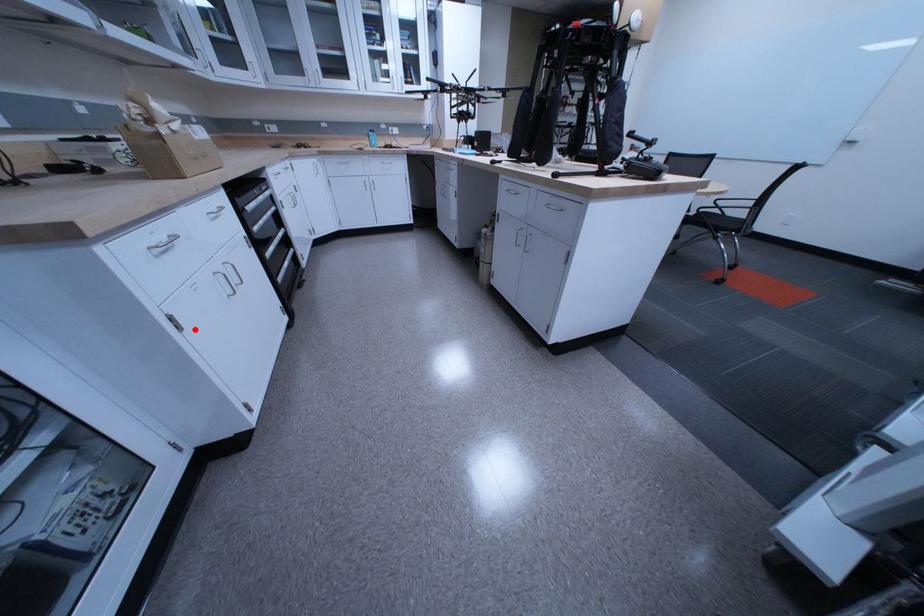
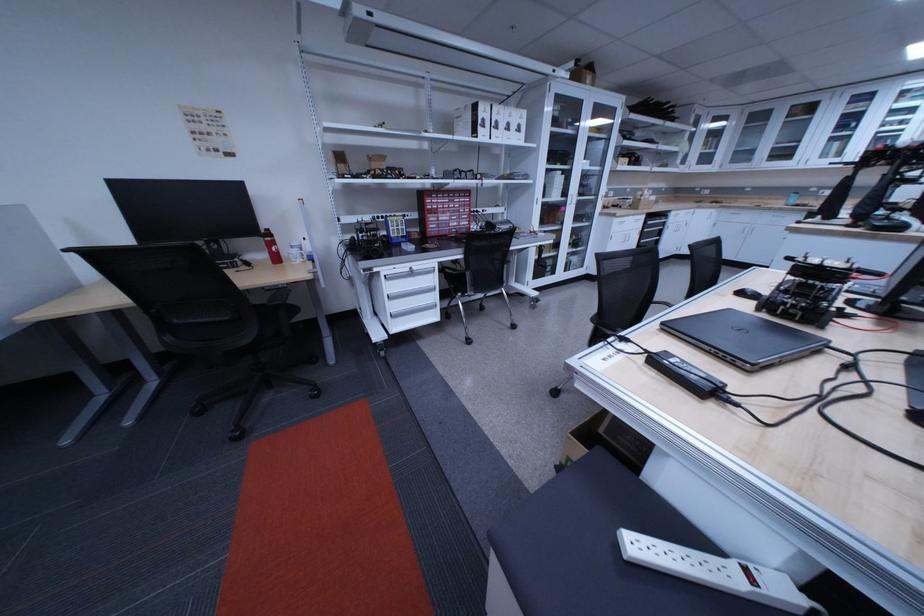
Locate, in the second image, the point that corresponds to the highlighted location in the first image.

(626, 241)